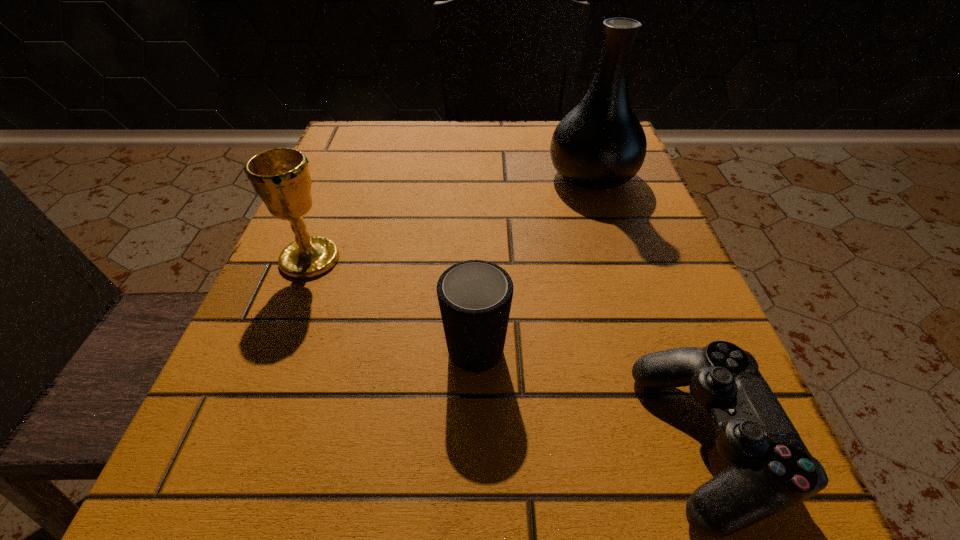
Find the location of `free space located 0.130m on the side of the mug with the handle`. free space located 0.130m on the side of the mug with the handle is located at coordinates [x=476, y=247].

Locate an element on the screen. Image resolution: width=960 pixels, height=540 pixels. object positioned at the far edge is located at coordinates (600, 144).

Where is `object at the left edge`? Image resolution: width=960 pixels, height=540 pixels. object at the left edge is located at coordinates coord(281,178).

This screenshot has height=540, width=960. I want to click on object that is positioned at the right edge, so click(x=600, y=144).

This screenshot has height=540, width=960. I want to click on object at the far right corner, so click(600, 144).

Locate an element on the screen. This screenshot has height=540, width=960. free space at the far edge of the desktop is located at coordinates (549, 157).

Image resolution: width=960 pixels, height=540 pixels. In order to click on vacant point at the near edge in this screenshot , I will do tap(435, 510).

In the image, there is a desktop. At what (x,y) coordinates should I click in order to perform the action: click on vacant area at the left edge. Please return your answer as a coordinate pair (x, y). Looking at the image, I should click on (378, 181).

Locate an element on the screen. This screenshot has height=540, width=960. vacant space at the right edge is located at coordinates (675, 341).

In the image, there is a desktop. What are the coordinates of `vacant space at the far left corner` in the screenshot? It's located at (362, 127).